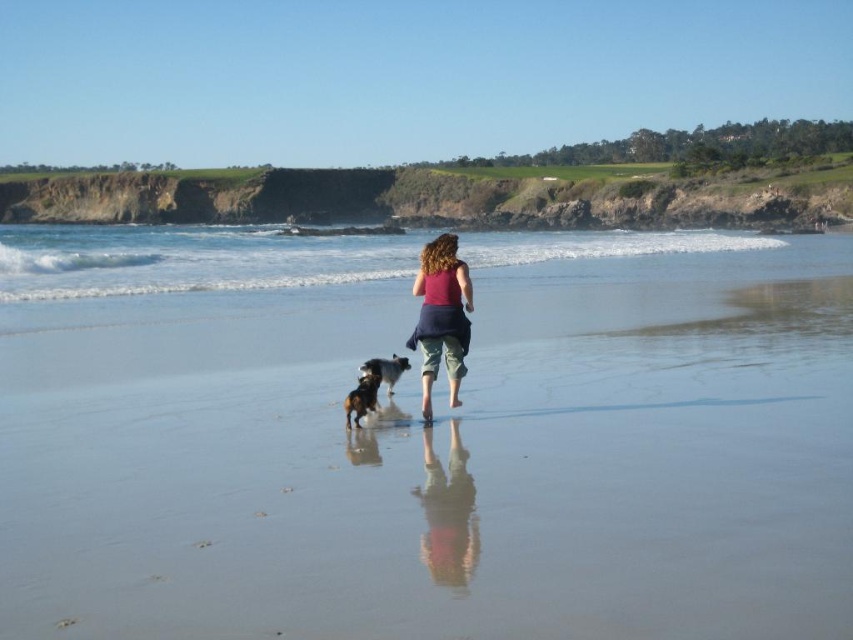
Question: Estimate the real-world distances between objects in this image. Which object is farther from the brown fur dog at center?

Choices:
 (A) sandy beach at center
 (B) shiny black fur at center
 (C) matte pink tank top at center

Answer: (A)

Question: Does sandy beach at center appear under brown fur dog at center?

Choices:
 (A) yes
 (B) no

Answer: (B)

Question: Which object is farther from the camera taking this photo?

Choices:
 (A) matte pink tank top at center
 (B) brown fur dog at center
 (C) shiny black fur at center

Answer: (C)

Question: Is brown fur dog at center positioned at the back of shiny black fur at center?

Choices:
 (A) no
 (B) yes

Answer: (A)

Question: Can you confirm if matte pink tank top at center is positioned above brown fur dog at center?

Choices:
 (A) no
 (B) yes

Answer: (A)

Question: Which object is positioned farthest from the brown fur dog at center?

Choices:
 (A) matte pink tank top at center
 (B) sandy beach at center

Answer: (B)